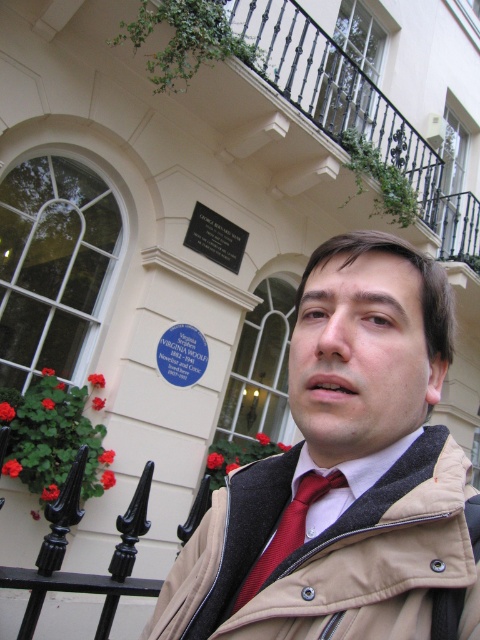
What do you see at coordinates (288, 531) in the screenshot? I see `red satin tie at center` at bounding box center [288, 531].

Does red satin tie at center have a larger size compared to black polished stone plaque at upper center?

No, red satin tie at center is not bigger than black polished stone plaque at upper center.

Is point (299, 516) positioned behind point (225, 234)?

No, (299, 516) is in front of (225, 234).

Locate an element on the screen. red satin tie at center is located at coordinates (288, 531).

Is red tie at center wider than red satin tie at center?

Indeed, red tie at center has a greater width compared to red satin tie at center.

Does red tie at center have a lesser height compared to red satin tie at center?

No, red tie at center is not shorter than red satin tie at center.

Locate an element on the screen. red tie at center is located at coordinates (343, 472).

Can you confirm if red tie at center is positioned to the right of black polished stone plaque at upper center?

Yes, red tie at center is to the right of black polished stone plaque at upper center.

Between red tie at center and black polished stone plaque at upper center, which one has less height?

Standing shorter between the two is black polished stone plaque at upper center.

Who is more distant from viewer, (383, 364) or (236, 262)?

The point (236, 262) is more distant.

Where is `red tie at center`? The image size is (480, 640). red tie at center is located at coordinates (343, 472).